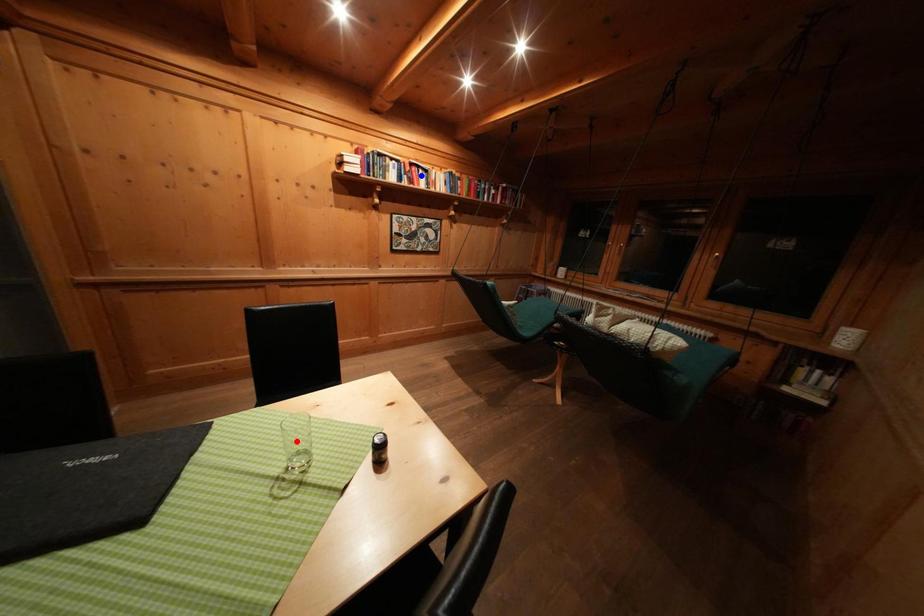
Question: Which of the two points in the image is closer to the camera?

Choices:
 (A) Blue point is closer.
 (B) Red point is closer.

Answer: (B)